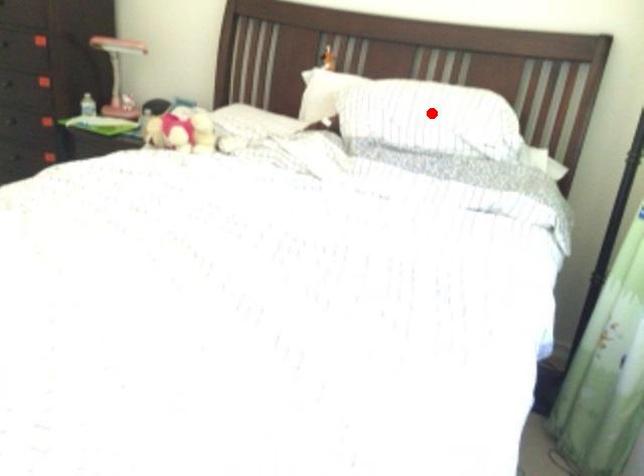
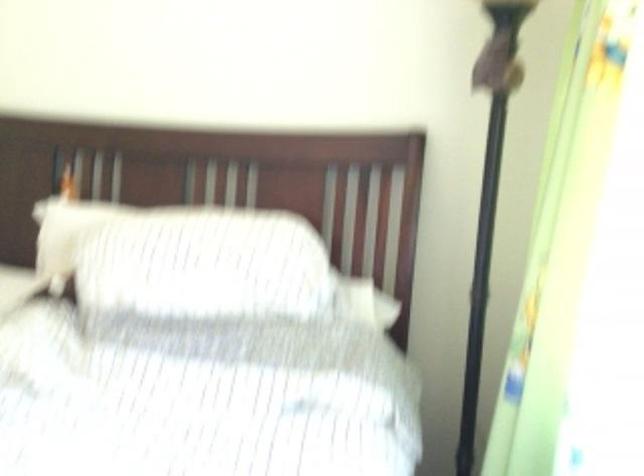
Find the pixel in the second image that matches the highlighted location in the first image.

(204, 267)